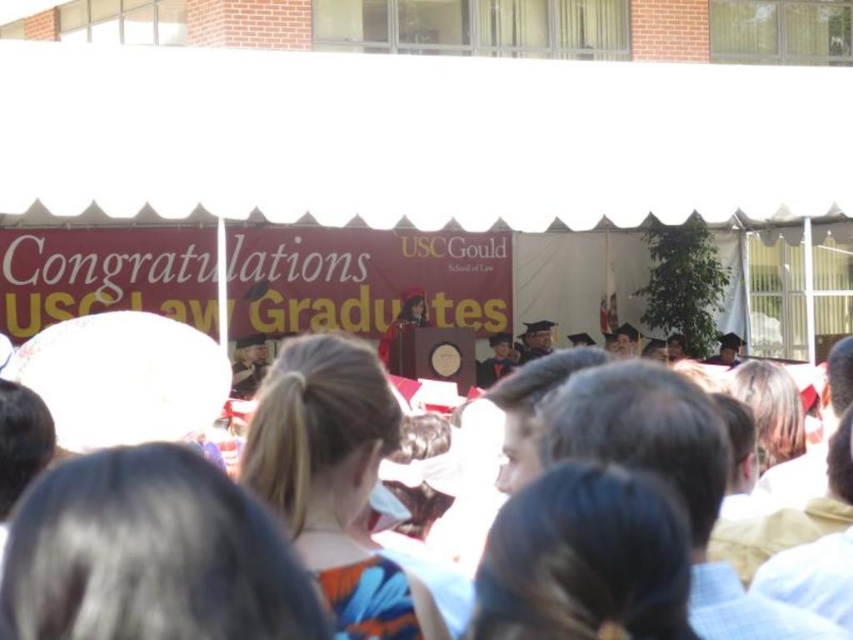
Question: Can you confirm if white fabric canopy at upper center is positioned to the left of white cloth crowd at center?

Choices:
 (A) no
 (B) yes

Answer: (B)

Question: Which of the following is the closest to the observer?

Choices:
 (A) (27, 346)
 (B) (88, 52)

Answer: (A)

Question: Is white fabric canopy at upper center bigger than white cloth crowd at center?

Choices:
 (A) yes
 (B) no

Answer: (A)

Question: Which object is closer to the camera taking this photo?

Choices:
 (A) white fabric canopy at upper center
 (B) white cloth crowd at center

Answer: (B)

Question: Does white fabric canopy at upper center appear on the left side of white cloth crowd at center?

Choices:
 (A) yes
 (B) no

Answer: (A)